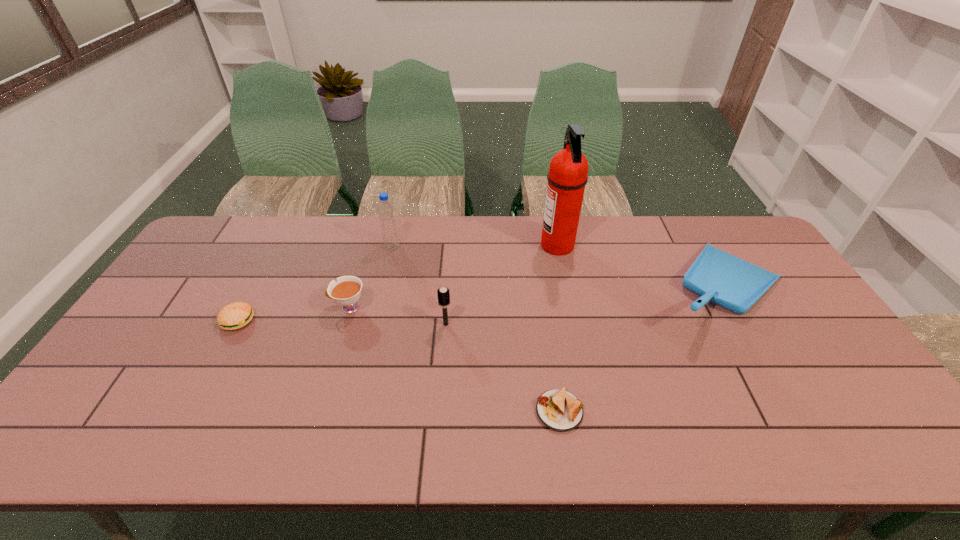
Locate an element on the screen. The width and height of the screenshot is (960, 540). vacant space located 0.250m on the back of the patty is located at coordinates (274, 254).

Identify the location of vacant region located 0.200m on the back of the shortest object. This screenshot has height=540, width=960. pos(547,329).

Find the location of `fire extinguisher present at the far edge`. fire extinguisher present at the far edge is located at coordinates (567, 177).

I want to click on water bottle present at the far edge, so click(x=386, y=212).

Image resolution: width=960 pixels, height=540 pixels. I want to click on dustpan situated at the far edge, so click(x=717, y=276).

The width and height of the screenshot is (960, 540). What are the coordinates of `object present at the near edge` in the screenshot? It's located at (558, 409).

You are a GUI agent. You are given a task and a screenshot of the screen. Output one action in this format:
    pyautogui.click(x=<x>, y=<y>)
    Task: Click on the object that is at the right edge
    The width and height of the screenshot is (960, 540).
    Given the screenshot: What is the action you would take?
    tap(717, 276)

Where is `object that is at the far right corner`? The image size is (960, 540). object that is at the far right corner is located at coordinates (717, 276).

You are a GUI agent. You are given a task and a screenshot of the screen. Output one action in this format:
    pyautogui.click(x=<x>, y=<y>)
    Task: Click on the free space at the far edge
    The image size is (960, 540).
    Given the screenshot: What is the action you would take?
    pyautogui.click(x=417, y=248)

In the image, there is a desktop. Identify the location of vacant space at the near edge. This screenshot has height=540, width=960. (557, 438).